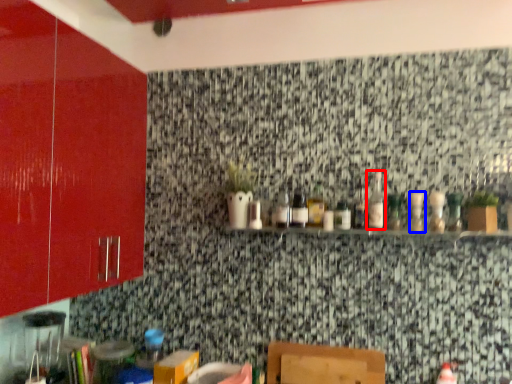
Question: Which object is further to the camera taking this photo, bottle (highlighted by a red box) or bottle (highlighted by a blue box)?

Choices:
 (A) bottle
 (B) bottle

Answer: (A)